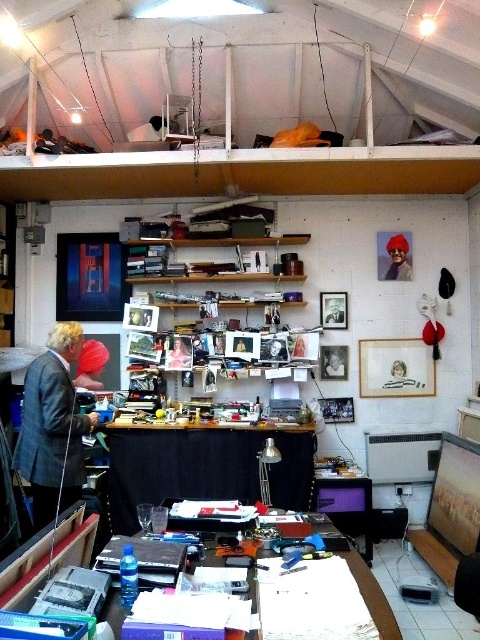
Is point (79, 477) positioned in front of point (405, 237)?

Yes, point (79, 477) is in front of point (405, 237).

Looking at this image, who is lower down, gray wool suit at left or matte red hat at upper right?

gray wool suit at left is lower down.

Identify the location of gray wool suit at left. This screenshot has width=480, height=640. (52, 426).

Does matte red hat at upper right appear under smooth skin portrait at center?

No, matte red hat at upper right is not below smooth skin portrait at center.

Between point (406, 266) and point (277, 340), which one is positioned in front?

Point (277, 340) is in front.

Between point (386, 276) and point (285, 356), which one is positioned behind?

Positioned behind is point (386, 276).

Identify the location of matte red hat at upper right. (397, 259).

Who is positioned more to the left, smooth skin portrait at center or matte black laptop at upper left?

Positioned to the left is matte black laptop at upper left.

Who is higher up, smooth skin portrait at center or matte black laptop at upper left?

matte black laptop at upper left is higher up.

You are a GUI agent. You are given a task and a screenshot of the screen. Output one action in this format:
    pyautogui.click(x=<x>, y=<y>)
    Task: Click on the smooth skin portrait at center
    This screenshot has width=480, height=640.
    Given the screenshot: What is the action you would take?
    pyautogui.click(x=273, y=349)